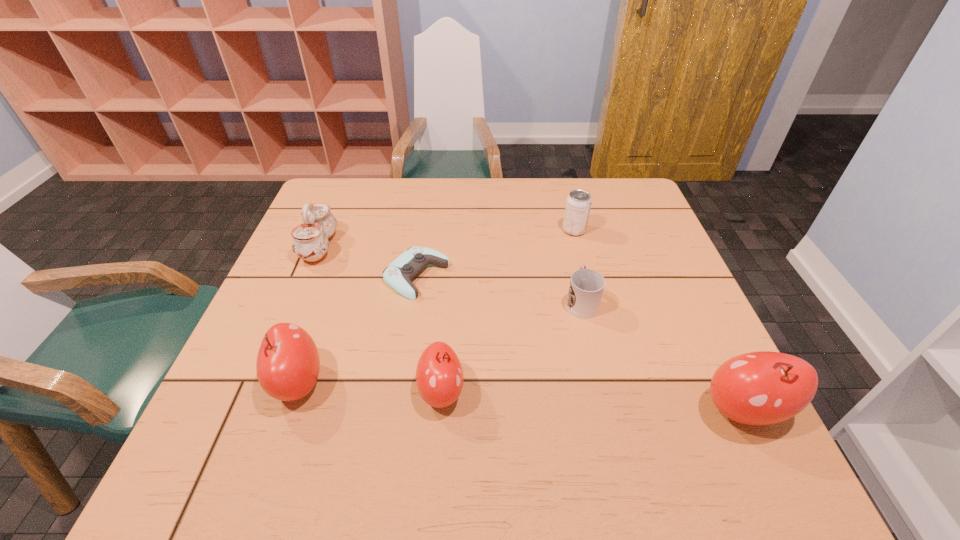
To achieve even spacing by inserting another apple among them, please point to a vacant spot for this new apple. Please provide its 2D coordinates. Your answer should be formatted as a tuple, i.e. [(x, y)], where the tuple contains the x and y coordinates of a point satisfying the conditions above.

[(589, 401)]